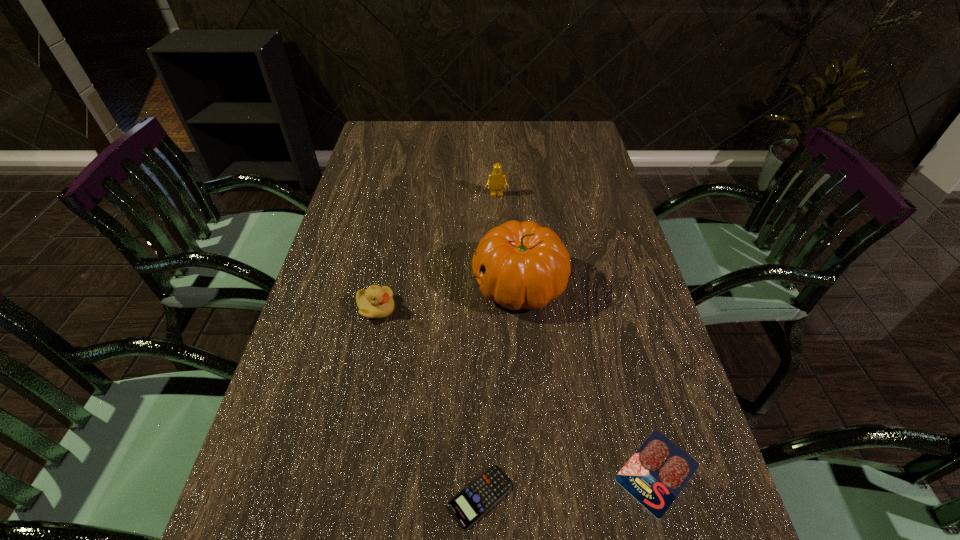
Identify which object is located as the third nearest to the tallest object. Please provide its 2D coordinates. Your answer should be formatted as a tuple, i.e. [(x, y)], where the tuple contains the x and y coordinates of a point satisfying the conditions above.

[(655, 475)]

Locate an element on the screen. The image size is (960, 540). vacant region that satisfies the following two spatial constraints: 1. on the face of the rightmost object; 2. on the left side of the farthest object is located at coordinates (509, 471).

Locate an element on the screen. vacant space that satisfies the following two spatial constraints: 1. on the face of the Lego; 2. on the beak of the third shortest object is located at coordinates (502, 309).

Locate an element on the screen. This screenshot has width=960, height=540. vacant position in the image that satisfies the following two spatial constraints: 1. on the face of the farthest object; 2. on the beak of the duckling is located at coordinates (502, 309).

Where is `free space in the image that satisfies the following two spatial constraints: 1. on the face of the Lego; 2. on the beak of the leftmost object`? Image resolution: width=960 pixels, height=540 pixels. free space in the image that satisfies the following two spatial constraints: 1. on the face of the Lego; 2. on the beak of the leftmost object is located at coordinates (502, 309).

Locate an element on the screen. vacant space that satisfies the following two spatial constraints: 1. on the beak of the duckling; 2. on the right side of the calculator is located at coordinates (336, 497).